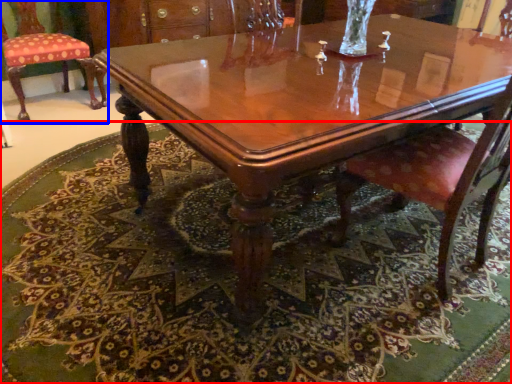
Question: Which of the following is the farthest to the observer, mat (highlighted by a red box) or chair (highlighted by a blue box)?

Choices:
 (A) mat
 (B) chair

Answer: (B)